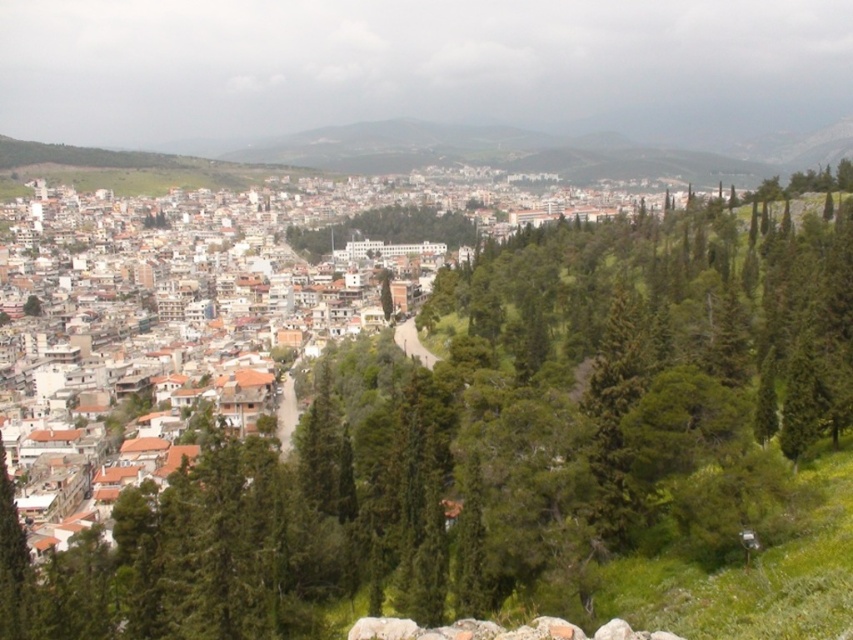
Where is `green leafy tree at center`? The width and height of the screenshot is (853, 640). green leafy tree at center is located at coordinates (438, 426).

From the picture: Is green leafy tree at center in front of green leafy trees at center?

Yes.

The width and height of the screenshot is (853, 640). What do you see at coordinates (438, 426) in the screenshot?
I see `green leafy tree at center` at bounding box center [438, 426].

Identify the location of green leafy tree at center. This screenshot has height=640, width=853. (438, 426).